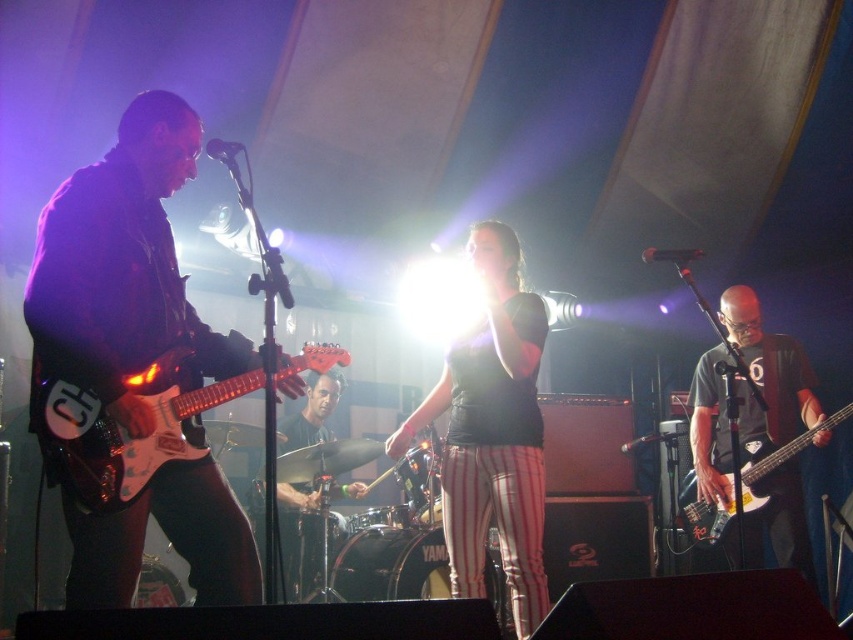
Between matte black guitar at left and matte black bass guitar at right, which one is positioned lower?

matte black bass guitar at right is lower down.

Can you confirm if matte black guitar at left is wider than matte black bass guitar at right?

Correct, the width of matte black guitar at left exceeds that of matte black bass guitar at right.

Does point (149, 337) lie in front of point (757, 337)?

Yes, it is.

In order to click on matte black guitar at left in this screenshot , I will do `click(122, 269)`.

Is point (473, 266) closer to camera compared to point (100, 433)?

No.

Does black matte shirt at center appear on the right side of white glossy electric guitar at left?

Yes, black matte shirt at center is to the right of white glossy electric guitar at left.

Is point (532, 330) in front of point (138, 460)?

No, it is behind (138, 460).

Where is `black matte shirt at center`? black matte shirt at center is located at coordinates (492, 432).

Does point (318, 406) come behind point (749, 496)?

Yes.

Who is positioned more to the left, black leather drumsticks at center or matte black bass at right?

black leather drumsticks at center is more to the left.

Describe the element at coordinates (312, 413) in the screenshot. I see `black leather drumsticks at center` at that location.

Locate an element on the screen. This screenshot has width=853, height=640. black leather drumsticks at center is located at coordinates (312, 413).